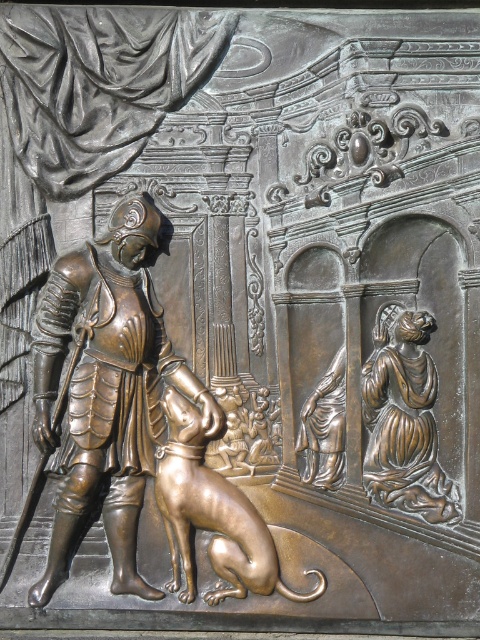
Can you confirm if bronze statue of woman at lower right is positioned to the right of bronze statue of woman at center?

Indeed, bronze statue of woman at lower right is positioned on the right side of bronze statue of woman at center.

Who is higher up, bronze statue of woman at lower right or bronze statue of woman at center?

bronze statue of woman at lower right

Is point (409, 381) behind point (319, 451)?

No, it is in front of (319, 451).

Identify the location of bronze statue of woman at lower right. This screenshot has height=640, width=480. click(x=404, y=419).

Is bronze armor at left bigger than bronze statue of woman at lower right?

Indeed, bronze armor at left has a larger size compared to bronze statue of woman at lower right.

Image resolution: width=480 pixels, height=640 pixels. What are the coordinates of `bronze armor at left` in the screenshot? It's located at (108, 392).

Is bronze armor at left wider than bronze statue of woman at center?

Correct, the width of bronze armor at left exceeds that of bronze statue of woman at center.

This screenshot has width=480, height=640. Find the location of `bronze armor at left`. bronze armor at left is located at coordinates (108, 392).